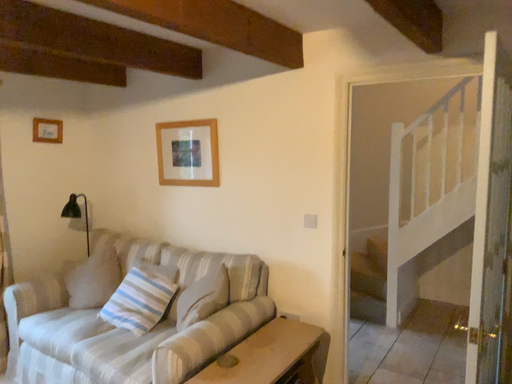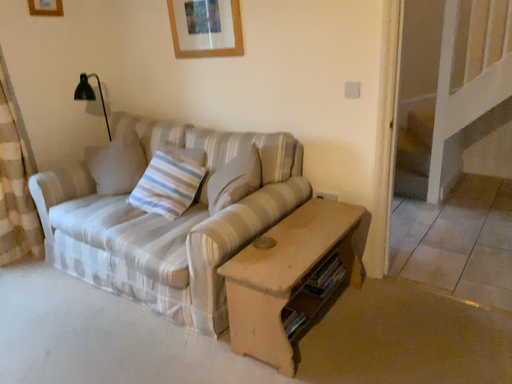
Question: How did the camera likely rotate when shooting the video?

Choices:
 (A) rotated downward
 (B) rotated upward

Answer: (A)